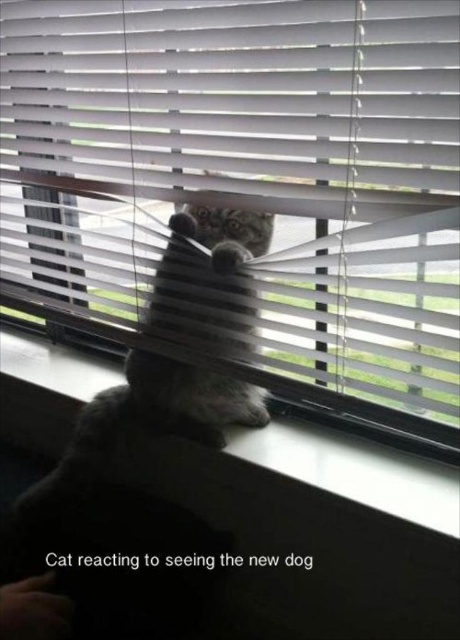
Does gray fluffy cat at center appear under white plastic window sill at center?

No, gray fluffy cat at center is not below white plastic window sill at center.

Who is taller, gray fluffy cat at center or white plastic window sill at center?

gray fluffy cat at center is taller.

Does point (86, 508) come closer to viewer compared to point (304, 472)?

No, it is behind (304, 472).

The height and width of the screenshot is (640, 460). In order to click on gray fluffy cat at center in this screenshot , I will do `click(151, 438)`.

Who is higher up, white plastic blinds at center or white plastic window sill at center?

Positioned higher is white plastic blinds at center.

Does white plastic blinds at center come in front of white plastic window sill at center?

Yes, white plastic blinds at center is closer to the viewer.

The width and height of the screenshot is (460, 640). Identify the location of white plastic blinds at center. (245, 186).

Does point (17, 108) come behind point (200, 332)?

That is True.

Is white plastic blinds at center closer to camera compared to gray fluffy cat at center?

Yes, it is in front of gray fluffy cat at center.

Is point (111, 97) positioned in front of point (92, 538)?

Yes, it is in front of point (92, 538).

This screenshot has width=460, height=640. I want to click on white plastic blinds at center, so click(x=245, y=186).